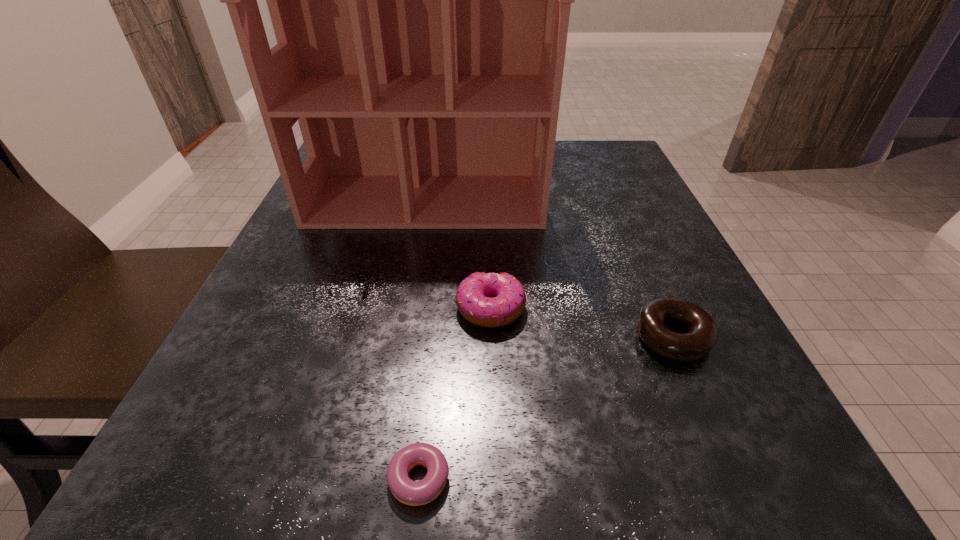
Identify the location of free space that is in between the dollhouse and the third shortest object. The width and height of the screenshot is (960, 540). (459, 255).

Locate an element on the screen. This screenshot has height=540, width=960. object that stands as the second closest to the dollhouse is located at coordinates (702, 333).

This screenshot has width=960, height=540. Find the location of `object that is the nearest to the dollhouse`. object that is the nearest to the dollhouse is located at coordinates (490, 300).

Locate which doughnut is the closest to the second tallest object. Please provide its 2D coordinates. Your answer should be formatted as a tuple, i.e. [(x, y)], where the tuple contains the x and y coordinates of a point satisfying the conditions above.

[(702, 333)]

Identify which doughnut is the nearest to the third tallest object. Please provide its 2D coordinates. Your answer should be formatted as a tuple, i.e. [(x, y)], where the tuple contains the x and y coordinates of a point satisfying the conditions above.

[(490, 300)]

Image resolution: width=960 pixels, height=540 pixels. In order to click on free location that satisfies the following two spatial constraints: 1. on the front-facing side of the farthest object; 2. on the right side of the tallest doughnut in this screenshot , I will do `click(407, 309)`.